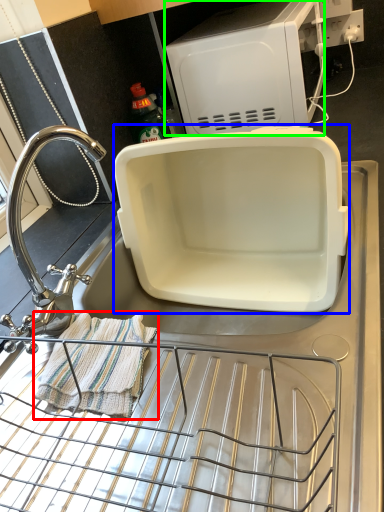
Question: Which object is positioned closest to blanket (highlighted by a red box)? Select from appliance (highlighted by a blue box) and appliance (highlighted by a green box).

Choices:
 (A) appliance
 (B) appliance

Answer: (A)